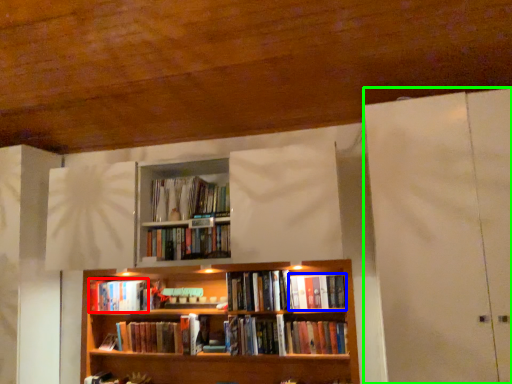
Question: Which object is the farthest from book (highlighted by a red box)? Choose among these: book (highlighted by a blue box) or glass door (highlighted by a green box).

Choices:
 (A) book
 (B) glass door

Answer: (B)